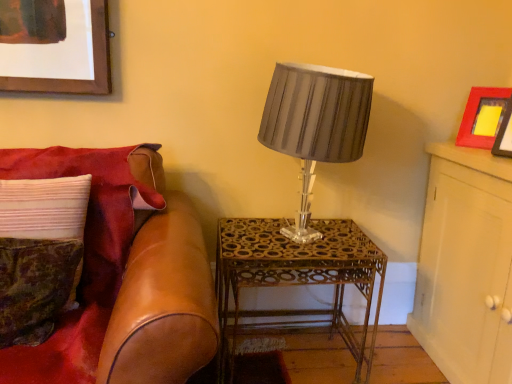
Question: Relative to matte gray fabric lampshade at center, is velvet green pillow at left, placed as the first pillow when sorted from front to back, in front or behind?

Choices:
 (A) behind
 (B) front

Answer: (B)

Question: Looking at the image, does velvet green pillow at left, which ranks as the second pillow in back-to-front order, seem bigger or smaller compared to matte gray fabric lampshade at center?

Choices:
 (A) big
 (B) small

Answer: (B)

Question: Which object is the closest to the leather couch at left?

Choices:
 (A) matte gray fabric lampshade at center
 (B) white textured pillow at left, which is the 1th pillow in back-to-front order
 (C) white wood cabinet at upper right
 (D) velvet green pillow at left, placed as the first pillow when sorted from front to back
 (E) gold metallic table at center

Answer: (B)

Question: Which object is positioned closest to the matte gray fabric lampshade at center?

Choices:
 (A) white wood cabinet at upper right
 (B) matte red picture frame at upper right
 (C) velvet green pillow at left, placed as the first pillow when sorted from front to back
 (D) gold metallic table at center
 (E) leather couch at left

Answer: (D)